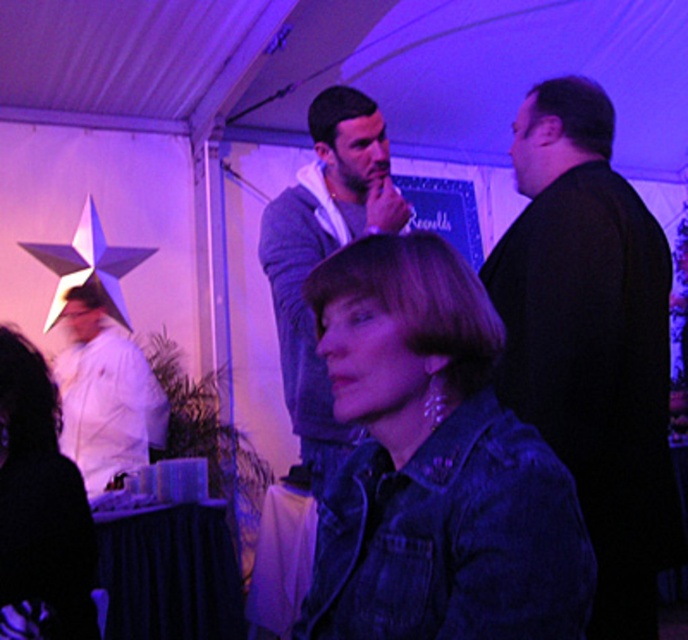
You are a photographer at the event and need to decide which clothing item to focus on for a closeup shot. The knitted sweater at center and the white matte chef coat at left are both in view. Which item has a smaller width and would be easier to frame without distortion?

The knitted sweater at center is thinner than the white matte chef coat at left, so it has a smaller width and would be easier to frame without distortion.

You are organizing a clothing display and need to place the black matte jacket at right and the knitted sweater at center on a rack. If the rack has a limited width, which item requires more space horizontally?

The black matte jacket at right requires more horizontal space because its width surpasses that of the knitted sweater at center.

In the scene, there are a black matte jacket at right and a knitted sweater at center. Which one is positioned more to the right side of the image?

The black matte jacket at right is positioned more to the right side of the image than the knitted sweater at center.